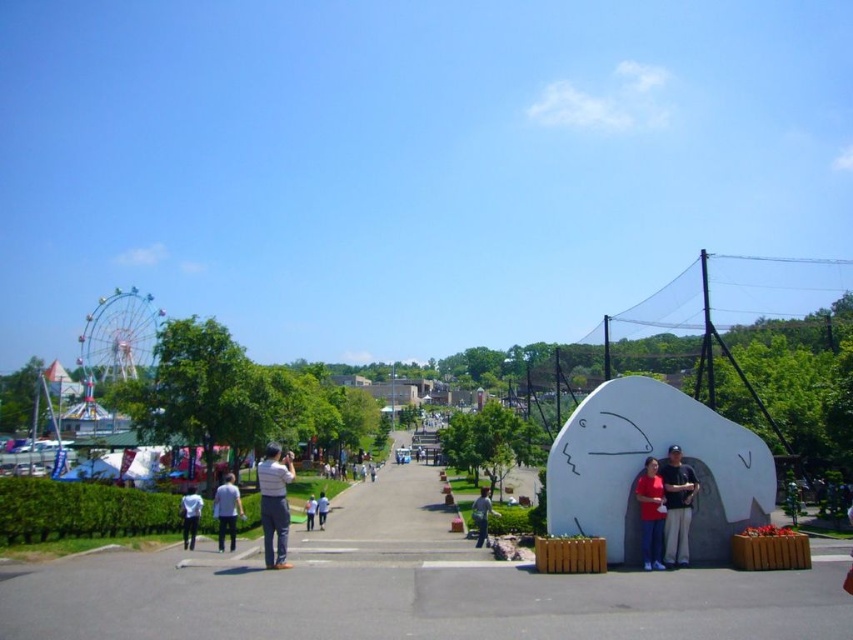
Question: Does white matte shirt at lower left have a smaller size compared to white matte person at center?

Choices:
 (A) no
 (B) yes

Answer: (A)

Question: Which object is the farthest from the white cotton shirt at center?

Choices:
 (A) white matte shirt at lower left
 (B) matte red shirt at center
 (C) white matte sculpture at right
 (D) light blue denim jeans at center

Answer: (C)

Question: Which object appears farthest from the camera in this image?

Choices:
 (A) white matte sculpture at right
 (B) white matte shirt at lower left
 (C) light blue shirt at center
 (D) light blue denim jeans at center

Answer: (D)

Question: Which object is farther from the camera taking this photo?

Choices:
 (A) light blue denim jeans at center
 (B) matte red shirt at center
 (C) white matte stone sculpture at right

Answer: (A)

Question: In this image, where is matte red shirt at center located relative to light blue denim jeans at center?

Choices:
 (A) left
 (B) right

Answer: (B)

Question: Does white matte stone sculpture at right have a smaller size compared to light blue shirt at center?

Choices:
 (A) yes
 (B) no

Answer: (A)